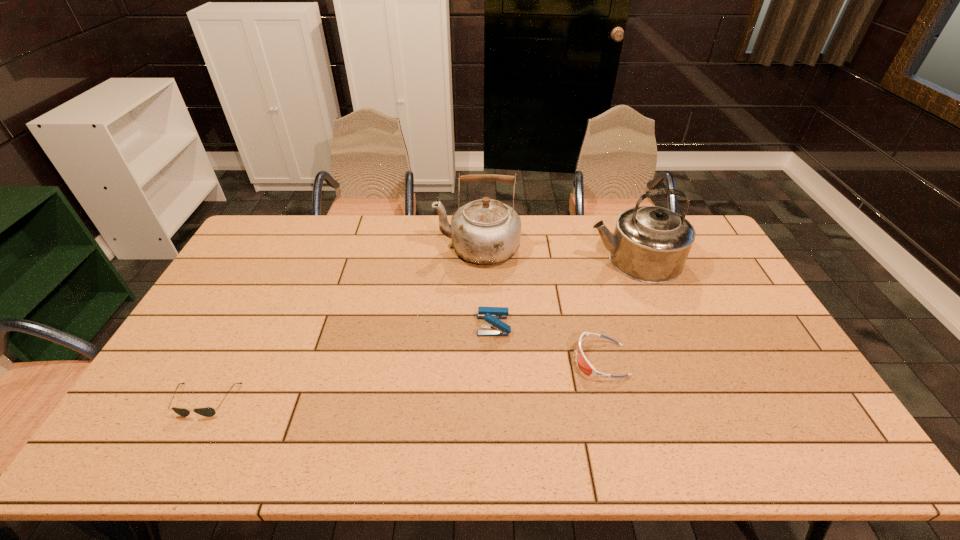
At what (x,y) coordinates should I click in order to perform the action: click on free location located at the spout of the left kettle. Please return your answer as a coordinate pair (x, y). The image size is (960, 540). Looking at the image, I should click on (416, 248).

Where is `blank area located 0.220m with the spout at the front of the right kettle`? The height and width of the screenshot is (540, 960). blank area located 0.220m with the spout at the front of the right kettle is located at coordinates (523, 260).

Locate an element on the screen. free space located with the spout at the front of the right kettle is located at coordinates (x=532, y=260).

Find the location of a particular element. free location located with the spout at the front of the right kettle is located at coordinates (x=500, y=260).

Locate an element on the screen. The height and width of the screenshot is (540, 960). vacant space located on the front of the stapler is located at coordinates (497, 441).

Where is `free space located on the front-facing side of the second shortest object`? This screenshot has width=960, height=540. free space located on the front-facing side of the second shortest object is located at coordinates (472, 360).

I want to click on free region located 0.240m on the front-facing side of the second shortest object, so click(x=487, y=360).

Identify the location of blank area located on the front-facing side of the second shortest object. (519, 360).

Where is `object that is at the left edge`? object that is at the left edge is located at coordinates (207, 412).

You are a GUI agent. You are given a task and a screenshot of the screen. Output one action in this format:
    pyautogui.click(x=<x>, y=<y>)
    Task: Click on the object that is positioned at the right edge
    
    Given the screenshot: What is the action you would take?
    pyautogui.click(x=650, y=244)